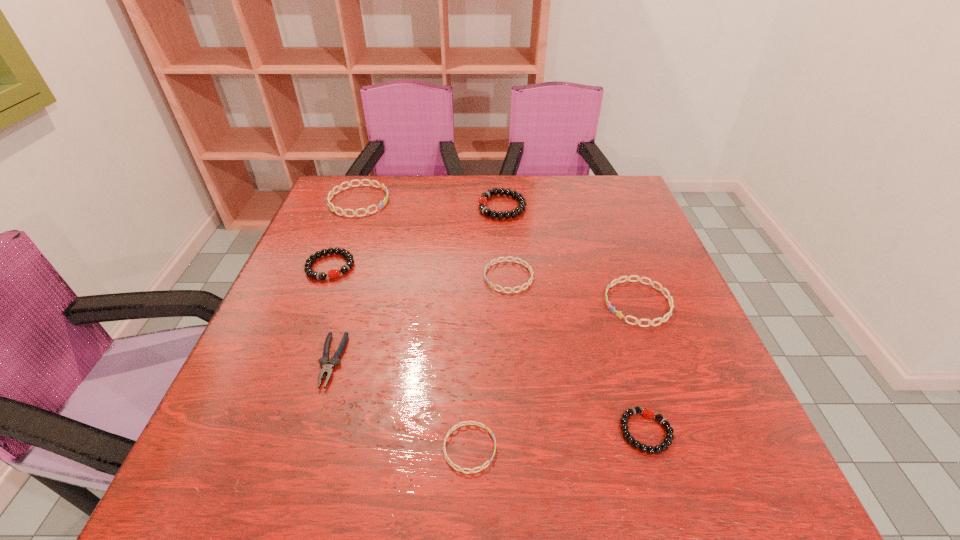
This screenshot has width=960, height=540. In order to click on vacant area located on the surface of the second smallest blue bracelet showing star-shaped elements in this screenshot , I will do `click(350, 277)`.

The height and width of the screenshot is (540, 960). I want to click on free region located on the surface of the second smallest blue bracelet showing star-shaped elements, so click(x=396, y=277).

The width and height of the screenshot is (960, 540). In order to click on vacant space located on the surface of the second smallest blue bracelet showing star-shaped elements in this screenshot , I will do `click(393, 277)`.

This screenshot has width=960, height=540. Find the location of `free spot located at the gripping part of the sixth farthest object`. free spot located at the gripping part of the sixth farthest object is located at coordinates (305, 446).

The height and width of the screenshot is (540, 960). I want to click on free space located on the right of the rightmost black bracelet, so click(701, 431).

The height and width of the screenshot is (540, 960). Find the location of `free location located on the surface of the shortest object showing star-shaped elements`. free location located on the surface of the shortest object showing star-shaped elements is located at coordinates (651, 448).

I want to click on pliers located in the left edge section of the desktop, so click(x=327, y=366).

You are a GUI agent. You are given a task and a screenshot of the screen. Output one action in this format:
    pyautogui.click(x=<x>, y=<y>)
    Task: Click on the object that is at the far left corner
    Image resolution: width=960 pixels, height=540 pixels.
    Given the screenshot: What is the action you would take?
    point(384,188)

Where is `object present at the near right corner`? This screenshot has height=540, width=960. object present at the near right corner is located at coordinates (667, 441).

Where is `vacant space at the far edge of the desktop`? Image resolution: width=960 pixels, height=540 pixels. vacant space at the far edge of the desktop is located at coordinates (478, 191).